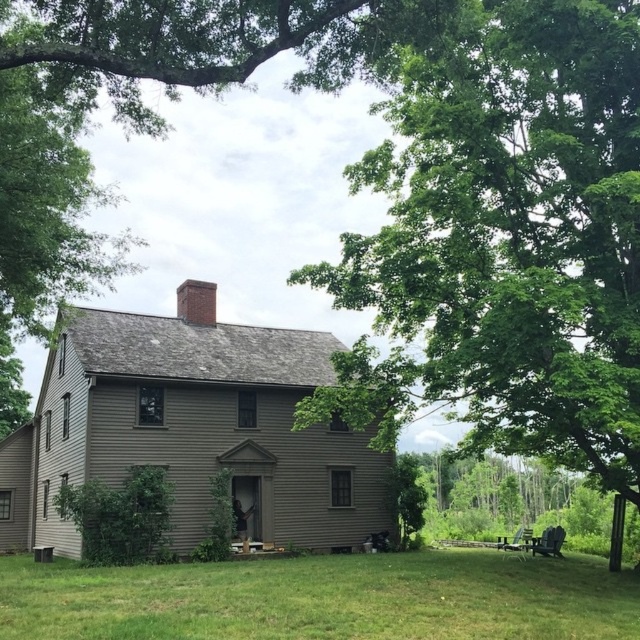
You are a gardener who needs to mow the lawn. Looking at the house, which area requires immediate attention based on the height of the green grass at lower center compared to the red brick chimney at upper center?

The green grass at lower center requires immediate attention because it is much taller than the red brick chimney at upper center, indicating it has grown significantly and needs mowing.